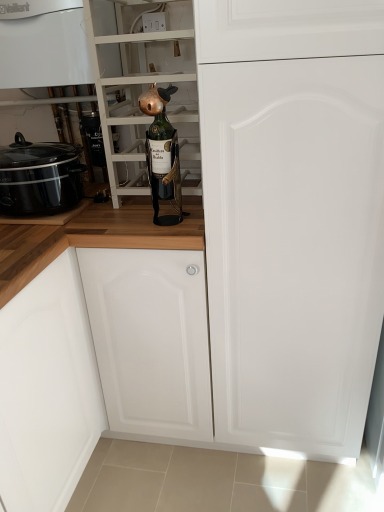
The image size is (384, 512). What do you see at coordinates (162, 153) in the screenshot?
I see `green glass bottle at center` at bounding box center [162, 153].

Identify the location of black glossy slow cooker at left. (39, 177).

The image size is (384, 512). Describe the element at coordinates (44, 51) in the screenshot. I see `white glossy boiler at upper left` at that location.

Where is `green glass bottle at center`? The height and width of the screenshot is (512, 384). green glass bottle at center is located at coordinates (144, 81).

Between white matte door at center and black glossy slow cooker at left, which one appears on the left side from the viewer's perspective?

Positioned to the left is black glossy slow cooker at left.

Between white matte door at center and black glossy slow cooker at left, which one has smaller size?

black glossy slow cooker at left is smaller.

Are white matte door at center and black glossy slow cooker at left beside each other?

No, white matte door at center is not making contact with black glossy slow cooker at left.

From the image's perspective, is white matte door at center on black glossy slow cooker at left?

No, from the image's perspective, white matte door at center is not above black glossy slow cooker at left.

From a real-world perspective, who is located higher, green glass bottle at center or white glossy boiler at upper left?

In real-world perspective, white glossy boiler at upper left is above.

From the picture: Is green glass bottle at center to the left or to the right of white glossy boiler at upper left in the image?

green glass bottle at center is positioned on white glossy boiler at upper left's right side.

Considering the positions of objects green glass bottle at center and white glossy boiler at upper left in the image provided, who is in front, green glass bottle at center or white glossy boiler at upper left?

green glass bottle at center is in front.

Is green glass bottle at center inside or outside of white glossy boiler at upper left?

green glass bottle at center is not enclosed by white glossy boiler at upper left.

Based on the photo, would you consider white glossy boiler at upper left to be distant from green glass bottle at center?

white glossy boiler at upper left is near green glass bottle at center, not far away.

Does white glossy boiler at upper left come behind green glass bottle at center?

Yes, white glossy boiler at upper left is further from the viewer.

From the image's perspective, is white glossy boiler at upper left above or below green glass bottle at center?

white glossy boiler at upper left is above green glass bottle at center.

Can we say white glossy boiler at upper left lies outside green glass bottle at center?

That's correct, white glossy boiler at upper left is outside of green glass bottle at center.

Is black glossy slow cooker at left not close to green glass bottle at center?

Actually, black glossy slow cooker at left and green glass bottle at center are a little close together.

Is black glossy slow cooker at left facing away from green glass bottle at center?

No, black glossy slow cooker at left is not facing away from green glass bottle at center.

From the picture: What's the angular difference between black glossy slow cooker at left and green glass bottle at center's facing directions?

The angle between the facing direction of black glossy slow cooker at left and the facing direction of green glass bottle at center is 0.000446 degrees.

Can green glass bottle at center be found inside black glossy slow cooker at left?

No, green glass bottle at center is not a part of black glossy slow cooker at left.

Considering the relative positions of green glass bottle at center and white matte door at center in the image provided, is green glass bottle at center to the left of white matte door at center from the viewer's perspective?

Yes, green glass bottle at center is to the left of white matte door at center.

Is the position of green glass bottle at center more distant than that of white matte door at center?

Yes, it is behind white matte door at center.

Considering the points (140, 95) and (244, 209), which point is behind, point (140, 95) or point (244, 209)?

Point (140, 95)

Could you tell me if green glass bottle at center is turned towards white matte door at center?

No, green glass bottle at center is not facing towards white matte door at center.

From the image's perspective, does green glass bottle at center appear higher than white glossy boiler at upper left?

Actually, green glass bottle at center appears below white glossy boiler at upper left in the image.

Is green glass bottle at center located outside white glossy boiler at upper left?

Indeed, green glass bottle at center is completely outside white glossy boiler at upper left.

Is green glass bottle at center taller or shorter than white glossy boiler at upper left?

Considering their sizes, green glass bottle at center has more height than white glossy boiler at upper left.

Find the location of a particular element. This screenshot has height=512, width=384. shelf above the white matte door at center (from a real-world perspective) is located at coordinates (144, 81).

Is green glass bottle at center outside of white matte door at center?

green glass bottle at center is positioned outside white matte door at center.

Does point (141, 120) come behind point (268, 381)?

No, (141, 120) is closer to viewer.

Is green glass bottle at center positioned behind white matte door at center?

Yes, it is.

Find the location of `door that appears below the black glossy slow cooker at left (from a real-world perspective)`. door that appears below the black glossy slow cooker at left (from a real-world perspective) is located at coordinates (294, 248).

This screenshot has height=512, width=384. Identify the location of shelf on the right side of white glossy boiler at upper left. (144, 81).

From the image, which object appears to be nearer to green glass bottle at center, green glass bottle at center or white glossy boiler at upper left?

green glass bottle at center lies closer to green glass bottle at center than the other object.

Looking at the image, which one is located further to green glass bottle at center, black glossy slow cooker at left or green glass bottle at center?

black glossy slow cooker at left.

From the image, which object appears to be nearer to black glossy slow cooker at left, green glass bottle at center or white glossy boiler at upper left?

Based on the image, white glossy boiler at upper left appears to be nearer to black glossy slow cooker at left.

From the image, which object appears to be nearer to black glossy slow cooker at left, white glossy boiler at upper left or white matte door at center?

white glossy boiler at upper left lies closer to black glossy slow cooker at left than the other object.

Looking at the image, which one is located further to white glossy boiler at upper left, green glass bottle at center or black glossy slow cooker at left?

Based on the image, green glass bottle at center appears to be further to white glossy boiler at upper left.

Considering their positions, is green glass bottle at center positioned further to white glossy boiler at upper left than white matte door at center?

white matte door at center is further to white glossy boiler at upper left.

Which object lies further to the anchor point black glossy slow cooker at left, white matte door at center or green glass bottle at center?

Based on the image, white matte door at center appears to be further to black glossy slow cooker at left.

Which object lies nearer to the anchor point white glossy boiler at upper left, black glossy slow cooker at left or green glass bottle at center?

The object closer to white glossy boiler at upper left is black glossy slow cooker at left.

I want to click on beer bottle between green glass bottle at center and white matte door at center, so click(162, 153).

At what (x,y) coordinates should I click in order to perform the action: click on beer bottle between white glossy boiler at upper left and white matte door at center in the horizontal direction. Please return your answer as a coordinate pair (x, y). Image resolution: width=384 pixels, height=512 pixels. Looking at the image, I should click on (162, 153).

In order to click on shelf situated between black glossy slow cooker at left and green glass bottle at center from left to right in this screenshot , I will do `click(144, 81)`.

Locate an element on the screen. beer bottle between white glossy boiler at upper left and black glossy slow cooker at left in the up-down direction is located at coordinates (162, 153).